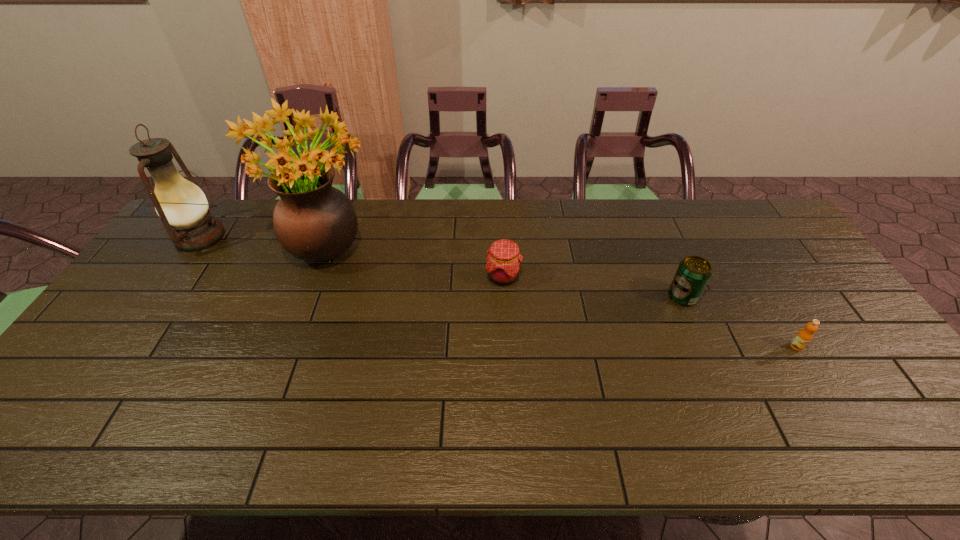
Locate an element on the screen. This screenshot has height=540, width=960. flower arrangement is located at coordinates (313, 221).

At what (x,y) coordinates should I click in order to perform the action: click on the leftmost object. Please return your answer as a coordinate pair (x, y). The width and height of the screenshot is (960, 540). Looking at the image, I should click on (182, 206).

What are the coordinates of `beer can` in the screenshot? It's located at (694, 272).

The image size is (960, 540). What are the coordinates of `jam` in the screenshot? It's located at (504, 260).

Find the location of a particular element. The width and height of the screenshot is (960, 540). the rightmost object is located at coordinates (803, 337).

You are a GUI agent. You are given a task and a screenshot of the screen. Output one action in this format:
    pyautogui.click(x=<x>, y=<y>)
    Task: Click on the nearest object
    This screenshot has height=540, width=960.
    Given the screenshot: What is the action you would take?
    pyautogui.click(x=803, y=337)

Where is `vacant space located 0.270m on the right of the fourth object from right to left`? This screenshot has width=960, height=540. vacant space located 0.270m on the right of the fourth object from right to left is located at coordinates (462, 245).

The width and height of the screenshot is (960, 540). What are the coordinates of `vacant area located 0.320m on the right of the oil lamp` in the screenshot? It's located at (325, 237).

At what (x,y) coordinates should I click in order to perform the action: click on vacant space positioned 0.260m on the front of the beer can. Please return your answer as a coordinate pair (x, y). Looking at the image, I should click on (723, 389).

Find the location of a particular element. free spot located on the front of the jam is located at coordinates (507, 346).